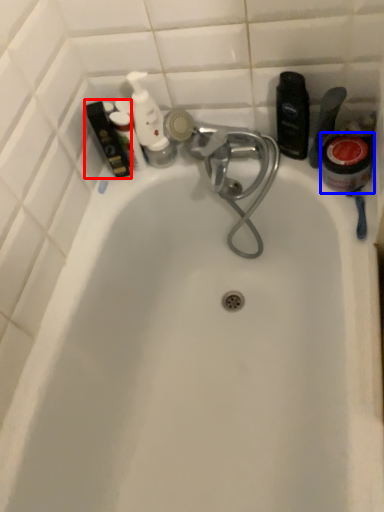
Question: Which of the following is the closest to the observer, toiletry (highlighted by a red box) or mouthwash (highlighted by a blue box)?

Choices:
 (A) toiletry
 (B) mouthwash

Answer: (B)